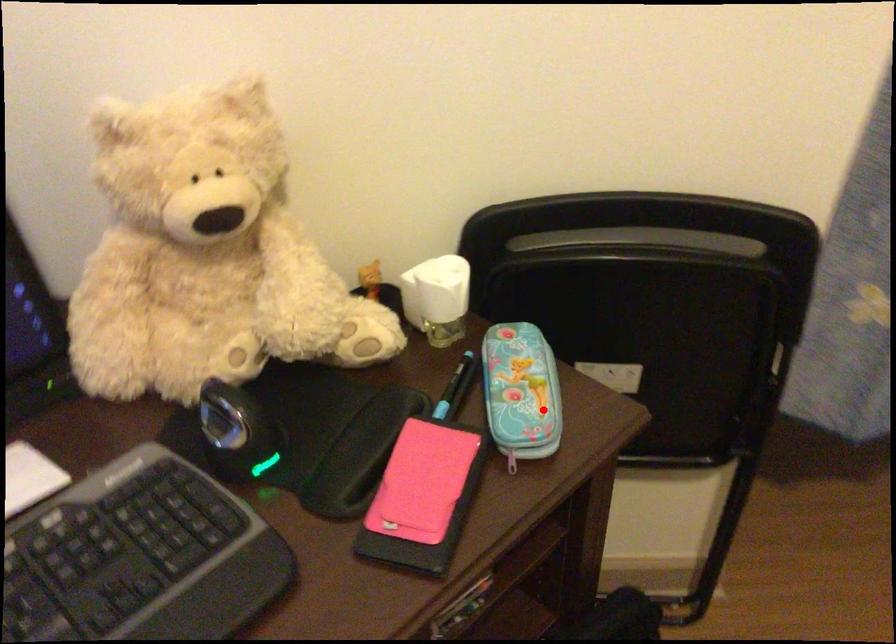
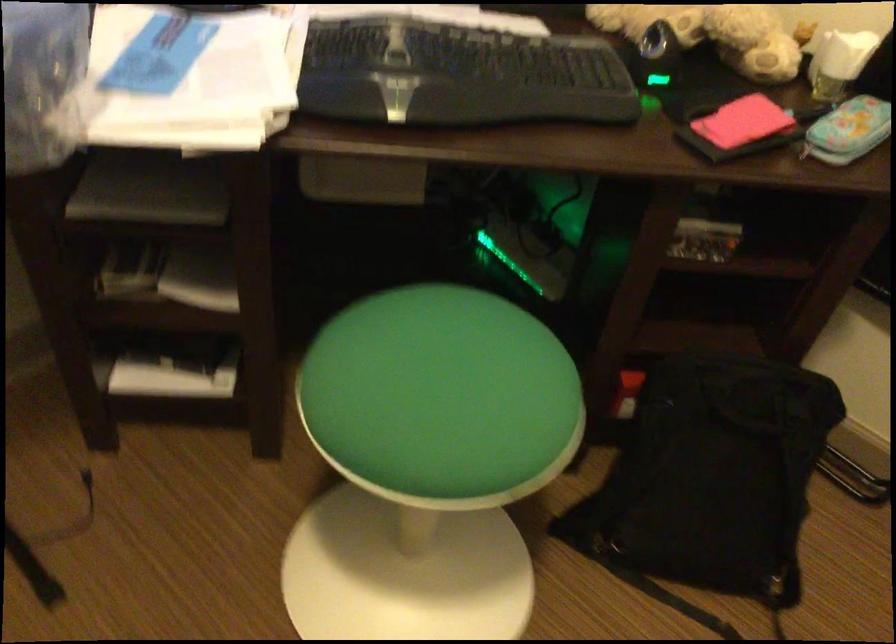
Question: I am providing you with two images of the same scene from different viewpoints. Image1 has a red point marked. In image2, the corresponding 3D location appears at what relative position? Reply with the corresponding letter.

Choices:
 (A) Closer
 (B) Farther

Answer: (B)